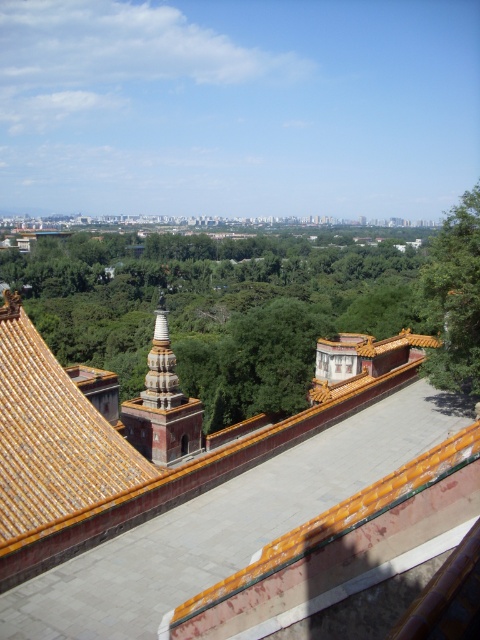
Question: Is orange glazed stupa at center closer to camera compared to white stone stupa at center?

Choices:
 (A) yes
 (B) no

Answer: (A)

Question: Which object is closer to the camera taking this photo?

Choices:
 (A) white stone stupa at center
 (B) green leafy tree at center
 (C) orange glazed stupa at center
 (D) golden glazed tiles at center

Answer: (D)

Question: Does gold glazed tiles at center come in front of orange glazed stupa at center?

Choices:
 (A) yes
 (B) no

Answer: (A)

Question: Estimate the real-world distances between objects in this image. Which object is farther from the green leafy tree at right?

Choices:
 (A) golden glazed tiles at center
 (B) orange glazed stupa at center

Answer: (B)

Question: Does green leafy tree at right appear on the left side of orange glazed stupa at center?

Choices:
 (A) no
 (B) yes

Answer: (A)

Question: Which is nearer to the orange glazed stupa at center?

Choices:
 (A) green leafy tree at right
 (B) gold glazed tiles at center
 (C) golden glazed tiles at center
 (D) green leafy tree at center

Answer: (B)